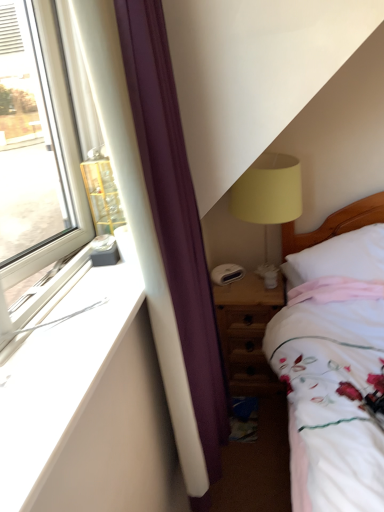
Question: From a real-world perspective, is wooden nightstand at lower right over white soft pillow at right?

Choices:
 (A) no
 (B) yes

Answer: (A)

Question: Does wooden nightstand at lower right contain white soft pillow at right?

Choices:
 (A) yes
 (B) no

Answer: (B)

Question: Considering the relative sizes of wooden nightstand at lower right and white soft pillow at right in the image provided, is wooden nightstand at lower right taller than white soft pillow at right?

Choices:
 (A) no
 (B) yes

Answer: (B)

Question: From a real-world perspective, is wooden nightstand at lower right located beneath white soft pillow at right?

Choices:
 (A) no
 (B) yes

Answer: (B)

Question: Is wooden nightstand at lower right outside white soft pillow at right?

Choices:
 (A) yes
 (B) no

Answer: (A)

Question: Considering their positions, is white soft pillow at right located in front of or behind matte yellow fabric lampshade at upper right?

Choices:
 (A) behind
 (B) front

Answer: (B)

Question: Considering the positions of white soft pillow at right and matte yellow fabric lampshade at upper right in the image, is white soft pillow at right bigger or smaller than matte yellow fabric lampshade at upper right?

Choices:
 (A) small
 (B) big

Answer: (A)

Question: From a real-world perspective, is white soft pillow at right positioned above or below matte yellow fabric lampshade at upper right?

Choices:
 (A) above
 (B) below

Answer: (B)

Question: In terms of width, does white soft pillow at right look wider or thinner when compared to matte yellow fabric lampshade at upper right?

Choices:
 (A) thin
 (B) wide

Answer: (B)

Question: Is white soft pillow at right wider or thinner than white smooth window sill at left?

Choices:
 (A) wide
 (B) thin

Answer: (A)

Question: Looking at the image, does white soft pillow at right seem bigger or smaller compared to white smooth window sill at left?

Choices:
 (A) small
 (B) big

Answer: (B)

Question: In the image, is white soft pillow at right positioned in front of or behind white smooth window sill at left?

Choices:
 (A) front
 (B) behind

Answer: (B)

Question: From the image's perspective, is white soft pillow at right located above or below white smooth window sill at left?

Choices:
 (A) below
 (B) above

Answer: (B)

Question: Relative to matte yellow fabric lampshade at upper right, is wooden nightstand at lower right in front or behind?

Choices:
 (A) front
 (B) behind

Answer: (B)

Question: Is wooden nightstand at lower right inside the boundaries of matte yellow fabric lampshade at upper right, or outside?

Choices:
 (A) inside
 (B) outside

Answer: (B)